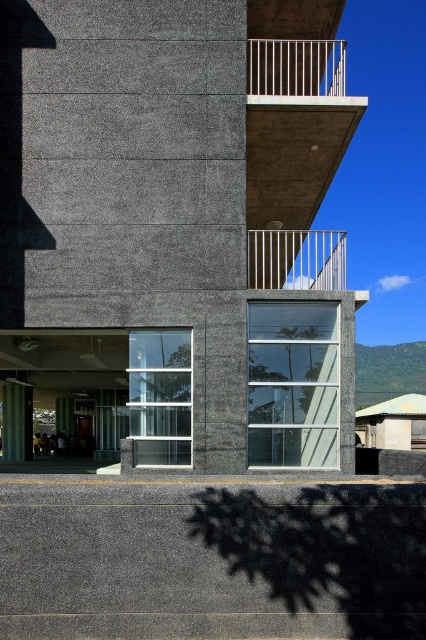
What are the coordinates of the silver metallic railing at upper center in the image?

The silver metallic railing at upper center is located at coordinates point (296, 259).

You are an architect evaluating the building layout. You need to ensure that the gray concrete at lower center is positioned in a way that does not block the view from the silver metallic railing at upper center. Based on the scene description, is this requirement met?

The gray concrete at lower center is below the silver metallic railing at upper center, so it does not block the view from the railing.